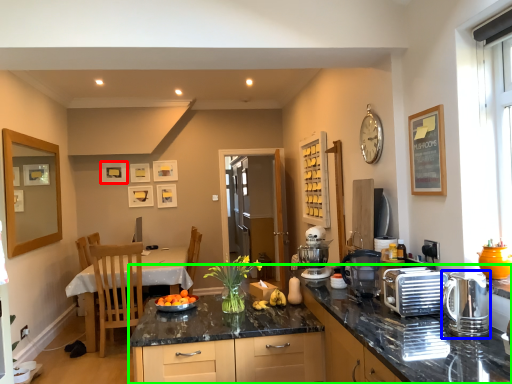
Question: Which object is the farthest from picture frame (highlighted by a red box)? Choose among these: kitchen appliance (highlighted by a blue box) or countertop (highlighted by a green box).

Choices:
 (A) kitchen appliance
 (B) countertop

Answer: (A)